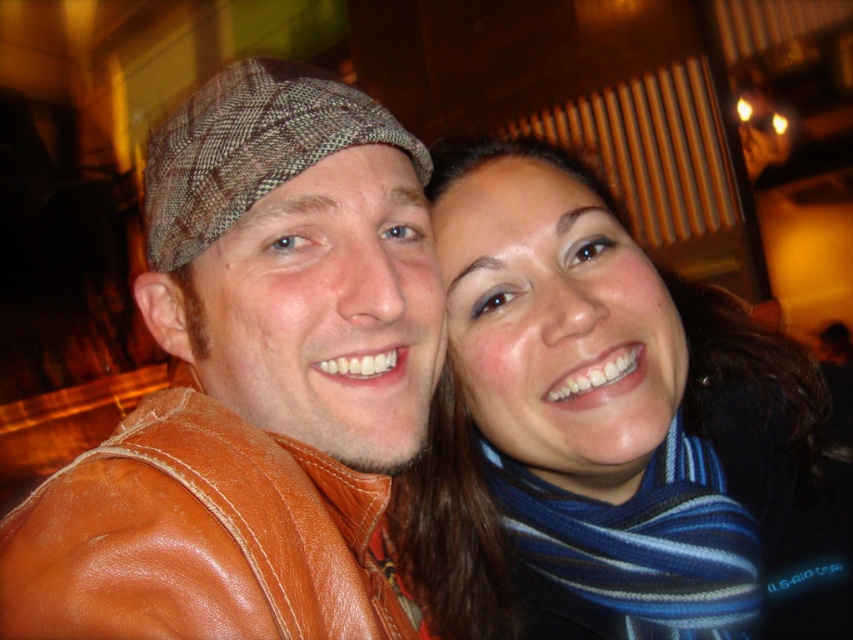
You are a photographer trying to adjust the lighting for a portrait. You notice the point at coordinates point (589, 419) in the image. What object is located at that point?

The point (589, 419) indicates the striped scarf at center.

You are a photographer trying to capture a detailed closeup of the blue striped scarf at lower right. Considering the current camera position, which is 33.38 inches away from the scarf, can you confirm if this distance is sufficient to achieve a clear, focused image?

The camera is currently 33.38 inches away from the blue striped scarf at lower right. This distance should be sufficient to capture a clear, focused image of the scarf as long as the camera settings are properly adjusted for the lighting conditions.

You are a photographer trying to capture a closeup of both the striped scarf at center and the blue striped scarf at lower right in this dimly lit setting. Given that your camera has a maximum focus range of 8 centimeters, will you be able to capture both scarves in focus without adjusting your position?

The distance between the striped scarf at center and the blue striped scarf at lower right is 7.84 centimeters, which is within the camera maximum focus range of 8 centimeters. Therefore, you can capture both scarves in focus without moving.